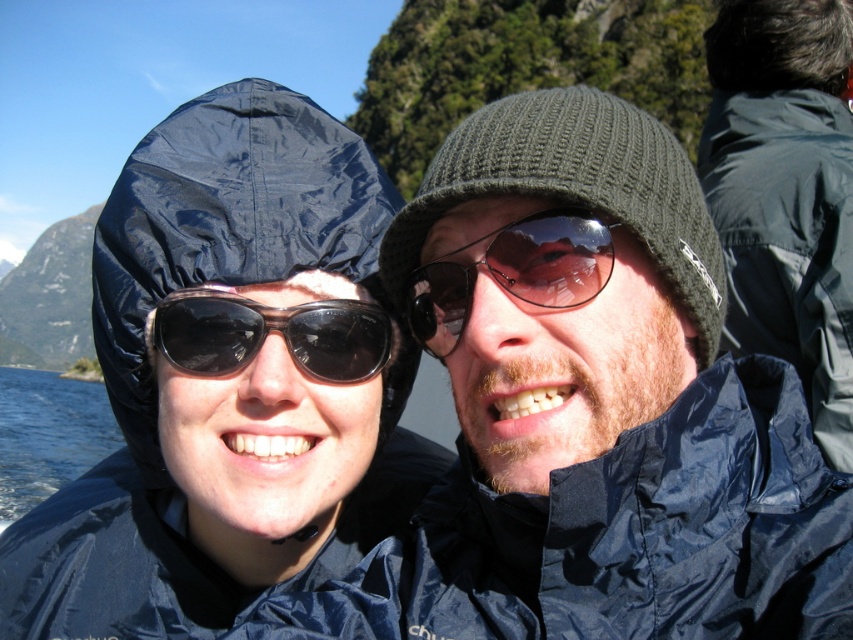
You are a photographer trying to capture a clear shot of the sunglasses at center without the knitted dark green beanie at center blocking it. Based on their positions, is this possible?

The knitted dark green beanie at center is in front of sunglasses at center, so it is blocking the view. To capture a clear shot of the sunglasses at center, you would need to adjust the angle or position to move the beanie out of the way.

You are a photographer trying to capture a clear shot of both the dark blue nylon jacket at upper right and the black reflective sunglasses at center. Since the sunglasses might reflect the camera flash, you want to position them so that the jacket is not in the reflection. Based on their positions, which object should be placed farther from the camera to avoid the reflection?

The dark blue nylon jacket at upper right is to the right of the black reflective sunglasses at center. To prevent the jacket from reflecting in the sunglasses, the dark blue nylon jacket at upper right should be placed farther from the camera than the black reflective sunglasses at center.

Based on the photo, you are a photographer trying to capture a clear shot of the dark blue nylon jacket at upper right. The camera you are using has a focus point at coordinate point (x=787, y=241). Will the jacket be in focus?

Yes, the dark blue nylon jacket at upper right is located exactly at point (x=787, y=241), so the camera focus point will capture it clearly.